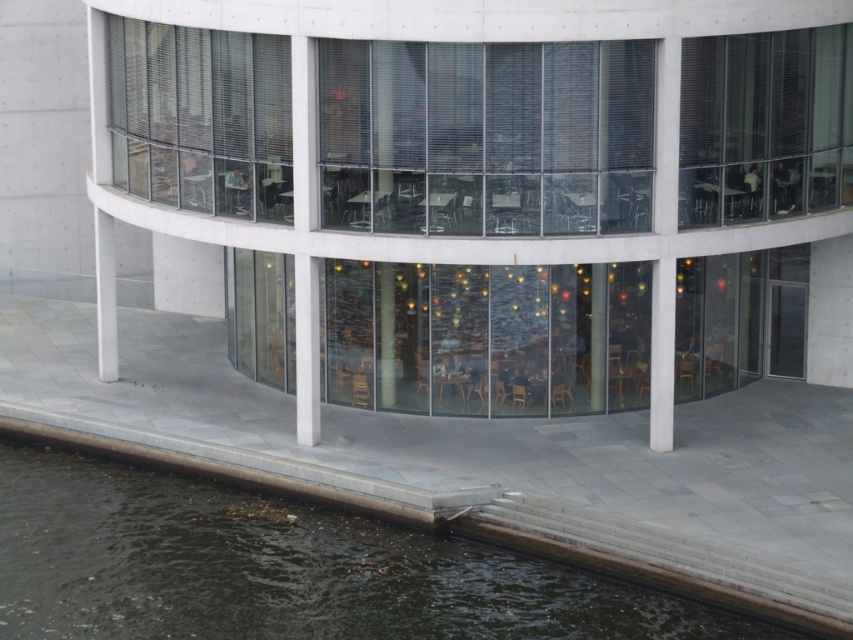
You are a visitor standing outside the modern architectural structure. You notice the dark water at lower left and the transparent glass pillar at center. Which object is shorter in height?

The dark water at lower left has a lesser height compared to the transparent glass pillar at center, so the dark water at lower left is shorter in height.

You are standing outside the modern building with large glass windows. You notice a point marked at coordinates (x=486, y=531). What is located at that point?

At point (x=486, y=531) lies dark water at lower left.

You are a window installer assessing the building. You need to replace the transparent glass window at upper right and the matte glass pillar at center. Which of these two requires a taller frame?

The transparent glass window at upper right requires a taller frame because it has a greater height compared to the matte glass pillar at center.